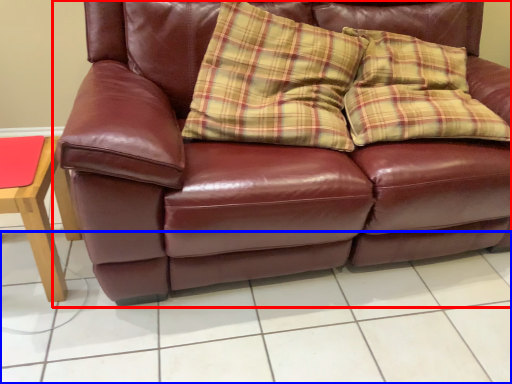
Question: Which object appears closest to the camera in this image, studio couch (highlighted by a red box) or tile (highlighted by a blue box)?

Choices:
 (A) studio couch
 (B) tile

Answer: (A)